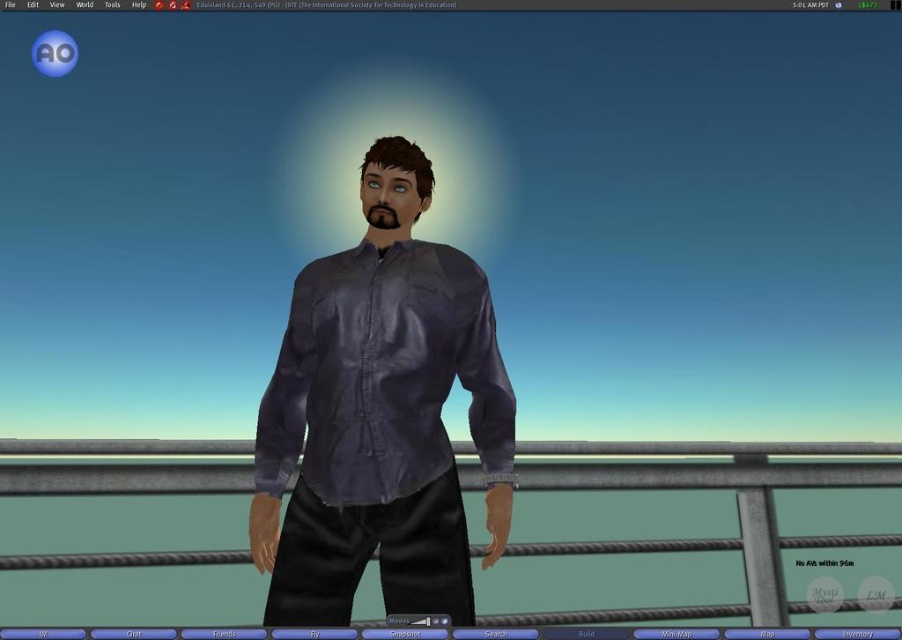
Question: Among these points, which one is nearest to the camera?

Choices:
 (A) (576, 468)
 (B) (373, 157)

Answer: (B)

Question: Is matte purple shirt at center further to the viewer compared to ropemetallicrail at center?

Choices:
 (A) no
 (B) yes

Answer: (A)

Question: Which point is farther to the camera?

Choices:
 (A) matte purple shirt at center
 (B) ropemetallicrail at center

Answer: (B)

Question: From the image, what is the correct spatial relationship of matte purple shirt at center in relation to ropemetallicrail at center?

Choices:
 (A) above
 (B) below

Answer: (A)

Question: Which point appears farthest from the camera in this image?

Choices:
 (A) (207, 442)
 (B) (295, 499)

Answer: (A)

Question: Can you confirm if matte purple shirt at center is thinner than ropemetallicrail at center?

Choices:
 (A) yes
 (B) no

Answer: (A)